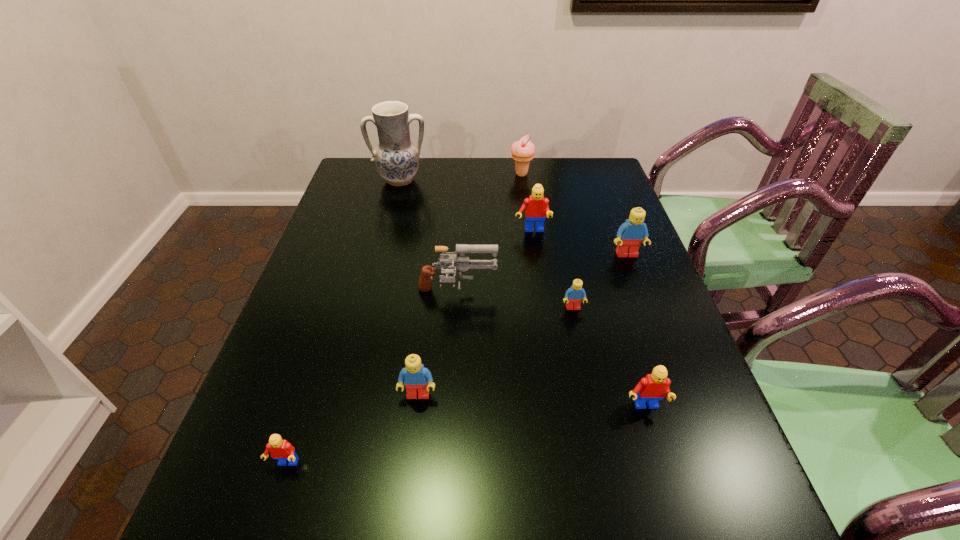
Locate an element on the screen. The height and width of the screenshot is (540, 960). pottery is located at coordinates (396, 158).

In order to click on blue pottery in this screenshot , I will do `click(396, 158)`.

Find the location of a particular element. Image resolution: width=960 pixels, height=540 pixels. icecream is located at coordinates (523, 151).

At what (x,y) coordinates should I click in order to perform the action: click on the second farthest Lego. Please return your answer as a coordinate pair (x, y). Looking at the image, I should click on (630, 234).

Locate an element on the screen. This screenshot has height=540, width=960. the farthest blue Lego is located at coordinates (630, 234).

What are the coordinates of `the seventh nearest object` in the screenshot? It's located at (536, 206).

Locate an element on the screen. This screenshot has width=960, height=540. the farthest red Lego is located at coordinates (536, 206).

This screenshot has height=540, width=960. What are the coordinates of `gun` in the screenshot? It's located at (460, 263).

Find the location of a particular element. The height and width of the screenshot is (540, 960). the second Lego from left to right is located at coordinates (417, 379).

Find the location of a particular element. The height and width of the screenshot is (540, 960). the leftmost blue Lego is located at coordinates (417, 379).